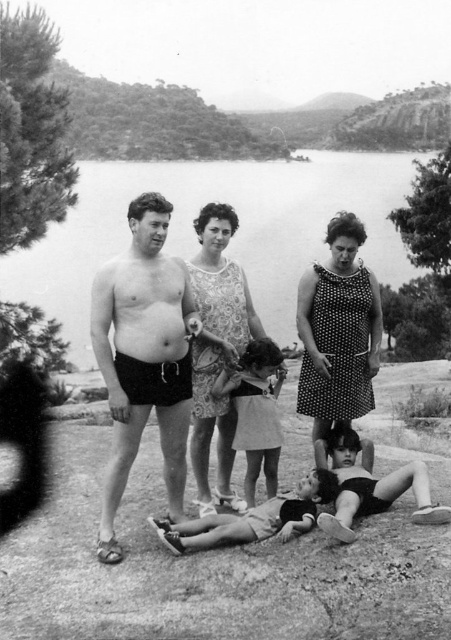
From the picture: Can you confirm if matte black shorts at center is taller than black matte shorts at center?

Yes, matte black shorts at center is taller than black matte shorts at center.

Is matte black shorts at center to the right of black matte shorts at center from the viewer's perspective?

Indeed, matte black shorts at center is positioned on the right side of black matte shorts at center.

This screenshot has width=451, height=640. What do you see at coordinates (168, 352) in the screenshot? I see `matte black shorts at center` at bounding box center [168, 352].

Where is `matte black shorts at center`? The height and width of the screenshot is (640, 451). matte black shorts at center is located at coordinates (168, 352).

Which is behind, point (409, 465) or point (208, 531)?

The point (208, 531) is more distant.

This screenshot has height=640, width=451. What are the coordinates of `black swimsuit girl at lower right` in the screenshot? It's located at (369, 484).

Image resolution: width=451 pixels, height=640 pixels. Find the location of `black swimsuit girl at lower right`. black swimsuit girl at lower right is located at coordinates (369, 484).

What are the coordinates of `black swimsuit girl at lower right` in the screenshot? It's located at (369, 484).

Which is more to the left, patterned fabric dress at center or black swimsuit girl at lower right?

patterned fabric dress at center is more to the left.

Measure the distance between patterned fabric dress at center and camera.

22.40 feet

Between point (229, 428) and point (442, 513), which one is positioned in front?

Point (442, 513) is more forward.

Locate an element on the screen. The image size is (451, 640). patterned fabric dress at center is located at coordinates (216, 349).